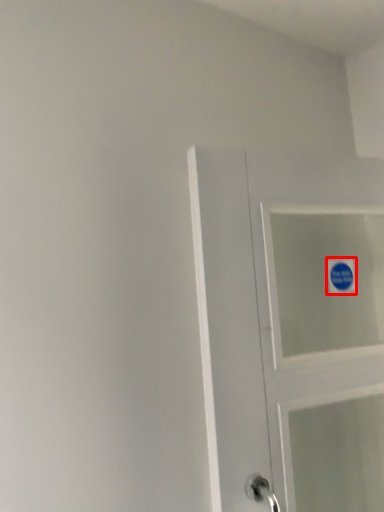
Question: From the image's perspective, what is the correct spatial relationship of sticker (annotated by the red box) in relation to door?

Choices:
 (A) below
 (B) above

Answer: (B)